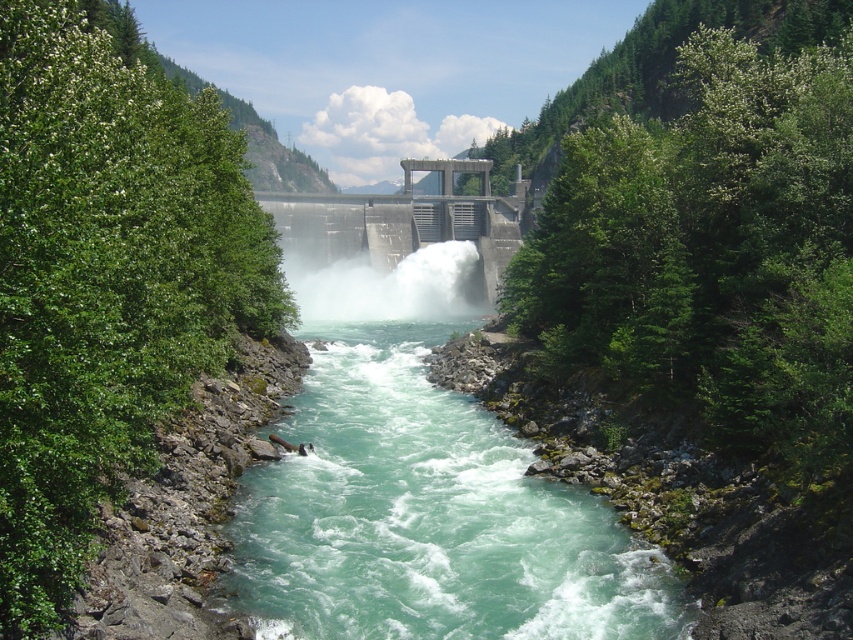
You are a kayaker planning to navigate through the dam area. You see the turquoise water at center and the white frothy water at center. Which part of the water should you avoid for safer passage?

You should avoid the white frothy water at center because it is positioned above the turquoise water at center, indicating it is the area where water is actively being released with strong currents and turbulence, making it dangerous. The turquoise water at center is calmer and safer for navigation.

You are a hiker standing at the edge of the river below the dam. You notice the turquoise water at center and the gray concrete dam at center. Which one is closer to you?

The turquoise water at center is closer to you because it is in front of the gray concrete dam at center.

You are a safety inspector evaluating the dam structure. You observe the gray concrete dam at center and the white frothy water at center. Based on their positions, what potential issue might you identify with the dam?

The gray concrete dam at center is positioned over the white frothy water at center, which could indicate that water is flowing over the dam structure itself, posing a risk of erosion or structural weakening.